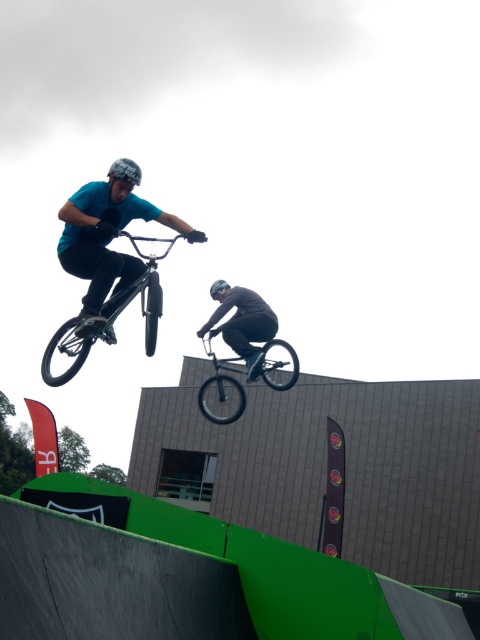
Can you confirm if matte blue shirt at upper left is wider than dark gray matte pants at center?

Indeed, matte blue shirt at upper left has a greater width compared to dark gray matte pants at center.

This screenshot has height=640, width=480. What do you see at coordinates (107, 237) in the screenshot?
I see `matte blue shirt at upper left` at bounding box center [107, 237].

Where is `matte blue shirt at upper left`? matte blue shirt at upper left is located at coordinates (107, 237).

Identify the location of matte blue shirt at upper left. This screenshot has width=480, height=640. coord(107,237).

Consider the image. Is shiny black bicycle at center wider than dark gray matte pants at center?

Indeed, shiny black bicycle at center has a greater width compared to dark gray matte pants at center.

Can you confirm if shiny black bicycle at center is smaller than dark gray matte pants at center?

Incorrect, shiny black bicycle at center is not smaller in size than dark gray matte pants at center.

Find the location of a particular element. Image resolution: width=480 pixels, height=640 pixels. shiny black bicycle at center is located at coordinates (220, 388).

Does matte blue shirt at upper left come behind shiny black bicycle at center?

That is False.

Who is positioned more to the right, matte blue shirt at upper left or shiny black bicycle at center?

Positioned to the right is shiny black bicycle at center.

Image resolution: width=480 pixels, height=640 pixels. I want to click on matte blue shirt at upper left, so click(107, 237).